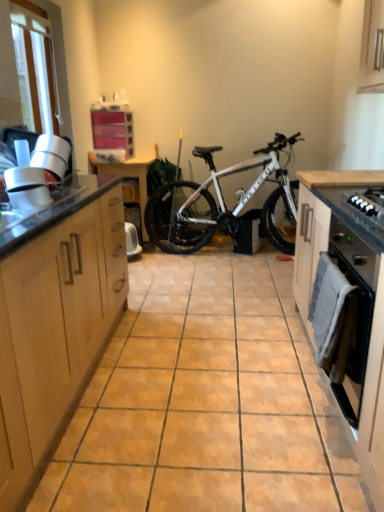
This screenshot has height=512, width=384. What are the coordinates of `free space to the back side of black matte oven door at right, marked as the 1th cabinetry in a right-to-left arrangement` in the screenshot? It's located at (279, 371).